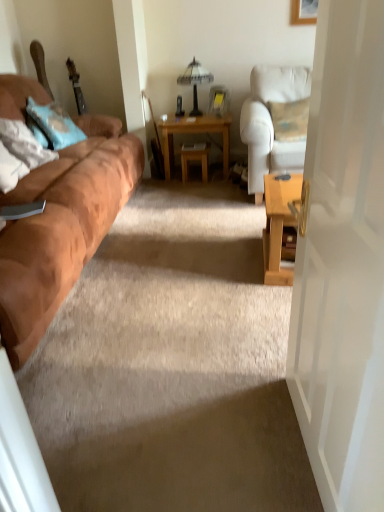
Question: Considering the positions of light brown wooden table at center and light blue fabric pillow at left, the first pillow positioned from the back, in the image, is light brown wooden table at center bigger or smaller than light blue fabric pillow at left, the first pillow positioned from the back,?

Choices:
 (A) big
 (B) small

Answer: (A)

Question: From a real-world perspective, is light brown wooden table at center positioned above or below light blue fabric pillow at left, the second pillow in the front-to-back sequence?

Choices:
 (A) above
 (B) below

Answer: (B)

Question: Considering the real-world distances, which object is farthest from the white glass table lamp at upper center?

Choices:
 (A) white fabric chair at right
 (B) light brown wooden table at center
 (C) white glossy door at right
 (D) soft white pillow at left, which is the 2th pillow from back to front
 (E) wooden stool at center

Answer: (C)

Question: Based on their relative distances, which object is nearer to the wooden picture frame at upper right?

Choices:
 (A) suede brown couch at left
 (B) white glossy door at right
 (C) wooden stool at center
 (D) white glass table lamp at upper center
 (E) light blue fabric pillow at left, the second pillow in the front-to-back sequence

Answer: (D)